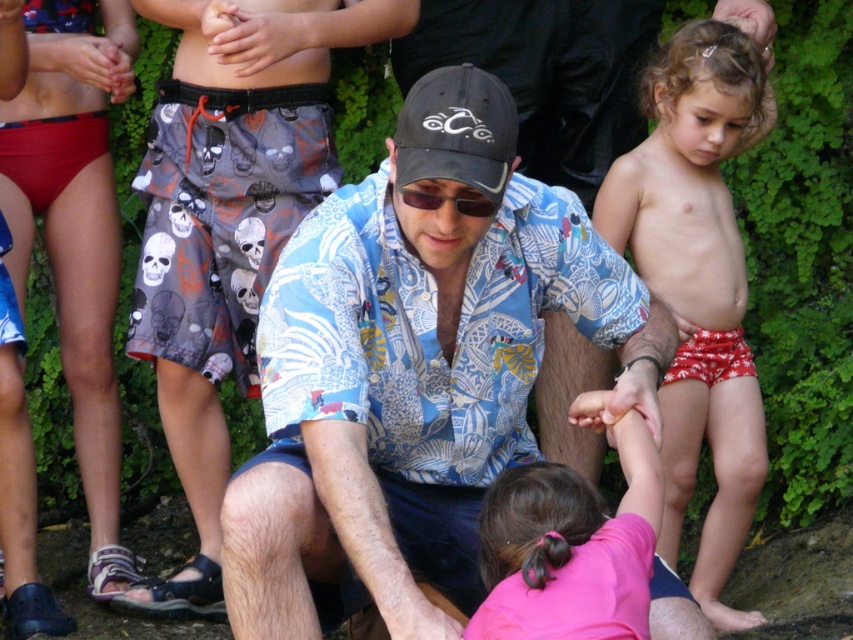
Question: Which point is closer to the camera taking this photo?

Choices:
 (A) (428, 195)
 (B) (479, 180)
 (C) (16, 138)

Answer: (B)

Question: Estimate the real-world distances between objects in this image. Which object is closer to the printed cotton shirt at center?

Choices:
 (A) skull-patterned shorts at center
 (B) pink fabric shirt at lower center
 (C) red printed shorts at right

Answer: (B)

Question: Is the position of red printed shorts at right less distant than that of pink fabric shirt at lower center?

Choices:
 (A) yes
 (B) no

Answer: (B)

Question: Does printed cotton shirt at center appear over skull-patterned shorts at center?

Choices:
 (A) yes
 (B) no

Answer: (B)

Question: Among these points, which one is nearest to the camera?

Choices:
 (A) (207, 371)
 (B) (421, 125)

Answer: (B)

Question: Does printed cotton shirt at center have a lesser width compared to pink fabric shirt at lower center?

Choices:
 (A) yes
 (B) no

Answer: (B)